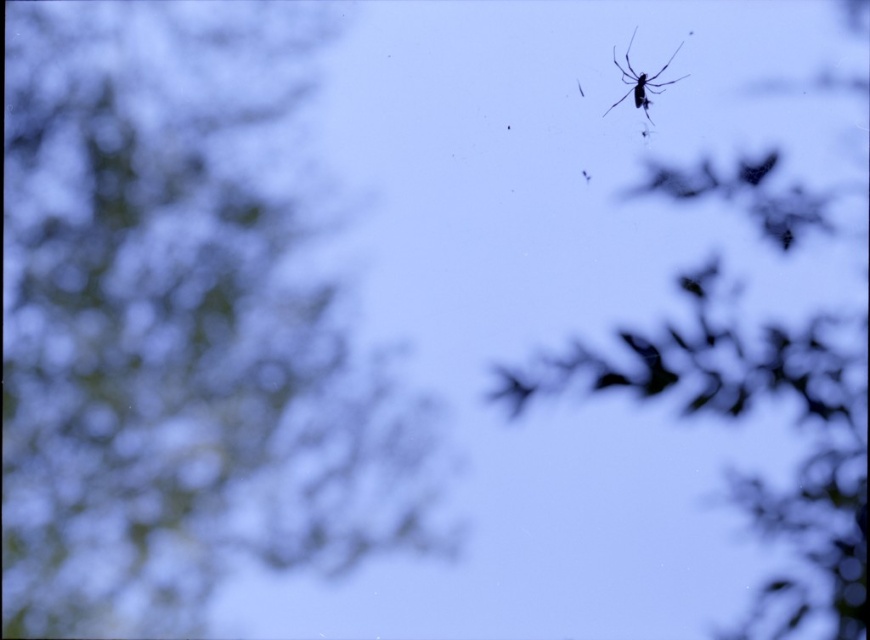
This screenshot has width=870, height=640. Describe the element at coordinates (175, 330) in the screenshot. I see `green matte tree at upper left` at that location.

Does point (198, 81) come closer to viewer compared to point (784, 356)?

No, (198, 81) is further to viewer.

What do you see at coordinates (175, 330) in the screenshot? I see `green matte tree at upper left` at bounding box center [175, 330].

I want to click on green matte tree at upper left, so click(x=175, y=330).

Does green matte tree at upper left appear over transparent silk spider at upper right?

No, green matte tree at upper left is not above transparent silk spider at upper right.

Does green matte tree at upper left have a lesser width compared to transparent silk spider at upper right?

In fact, green matte tree at upper left might be wider than transparent silk spider at upper right.

The width and height of the screenshot is (870, 640). I want to click on green matte tree at upper left, so (175, 330).

Which is more to the right, silvery metallic branch at upper right or transparent silk spider at upper right?

silvery metallic branch at upper right is more to the right.

Between silvery metallic branch at upper right and transparent silk spider at upper right, which one has less height?

With less height is transparent silk spider at upper right.

Does point (820, 403) come farther from viewer compared to point (628, 93)?

No, (820, 403) is closer to viewer.

I want to click on silvery metallic branch at upper right, so click(x=741, y=413).